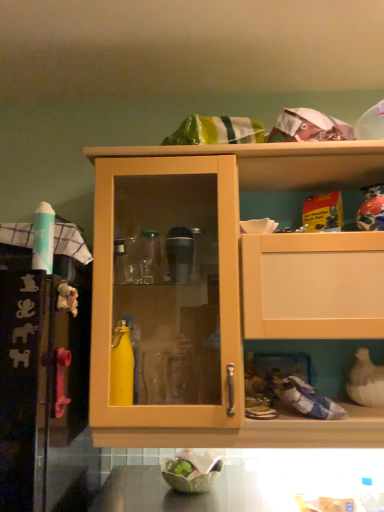
Question: Considering the relative sizes of green leafy material bowl at lower center and smooth dark brown countertop at lower center in the image provided, is green leafy material bowl at lower center shorter than smooth dark brown countertop at lower center?

Choices:
 (A) no
 (B) yes

Answer: (B)

Question: Are green leafy material bowl at lower center and smooth dark brown countertop at lower center making contact?

Choices:
 (A) yes
 (B) no

Answer: (B)

Question: Considering the relative positions of green leafy material bowl at lower center and smooth dark brown countertop at lower center in the image provided, is green leafy material bowl at lower center in front of smooth dark brown countertop at lower center?

Choices:
 (A) yes
 (B) no

Answer: (B)

Question: Is green leafy material bowl at lower center not within smooth dark brown countertop at lower center?

Choices:
 (A) yes
 (B) no

Answer: (A)

Question: Is green leafy material bowl at lower center at the left side of smooth dark brown countertop at lower center?

Choices:
 (A) yes
 (B) no

Answer: (A)

Question: Is matte wood cabinet at center inside or outside of green leafy material bowl at lower center?

Choices:
 (A) outside
 (B) inside

Answer: (A)

Question: Considering the positions of matte wood cabinet at center and green leafy material bowl at lower center in the image, is matte wood cabinet at center bigger or smaller than green leafy material bowl at lower center?

Choices:
 (A) small
 (B) big

Answer: (B)

Question: Is matte wood cabinet at center in front of or behind green leafy material bowl at lower center in the image?

Choices:
 (A) behind
 (B) front

Answer: (B)

Question: Considering the positions of matte wood cabinet at center and green leafy material bowl at lower center in the image, is matte wood cabinet at center taller or shorter than green leafy material bowl at lower center?

Choices:
 (A) short
 (B) tall

Answer: (B)

Question: From a real-world perspective, is green leafy material bowl at lower center positioned above or below matte wood cabinet at center?

Choices:
 (A) above
 (B) below

Answer: (B)

Question: Is green leafy material bowl at lower center wider or thinner than matte wood cabinet at center?

Choices:
 (A) thin
 (B) wide

Answer: (A)

Question: Is green leafy material bowl at lower center inside the boundaries of matte wood cabinet at center, or outside?

Choices:
 (A) outside
 (B) inside

Answer: (A)

Question: Is green leafy material bowl at lower center in front of or behind matte wood cabinet at center in the image?

Choices:
 (A) behind
 (B) front

Answer: (A)

Question: Is smooth dark brown countertop at lower center spatially inside green leafy material bowl at lower center, or outside of it?

Choices:
 (A) inside
 (B) outside

Answer: (B)

Question: Considering the positions of point (281, 474) and point (182, 449), is point (281, 474) closer or farther from the camera than point (182, 449)?

Choices:
 (A) closer
 (B) farther

Answer: (B)